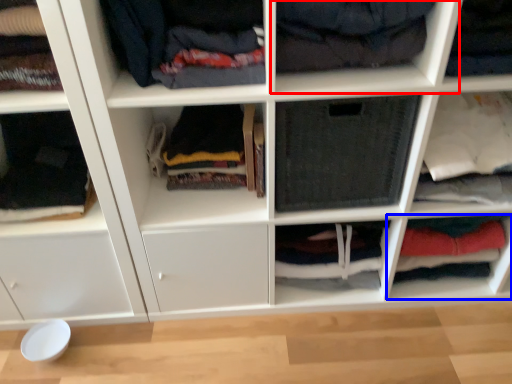
Question: Which of the following is the farthest to the observer, shelf (highlighted by a red box) or cabinet (highlighted by a blue box)?

Choices:
 (A) shelf
 (B) cabinet

Answer: (B)